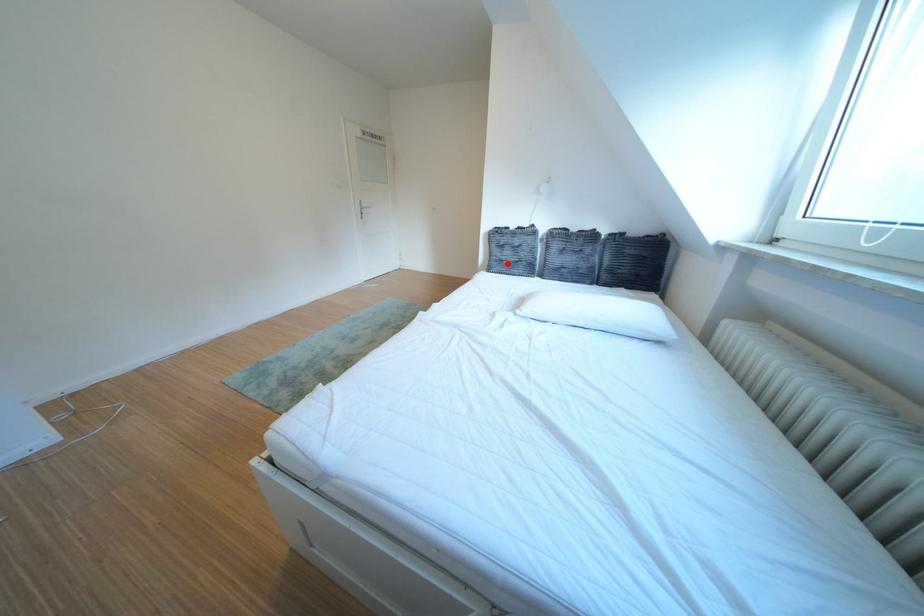
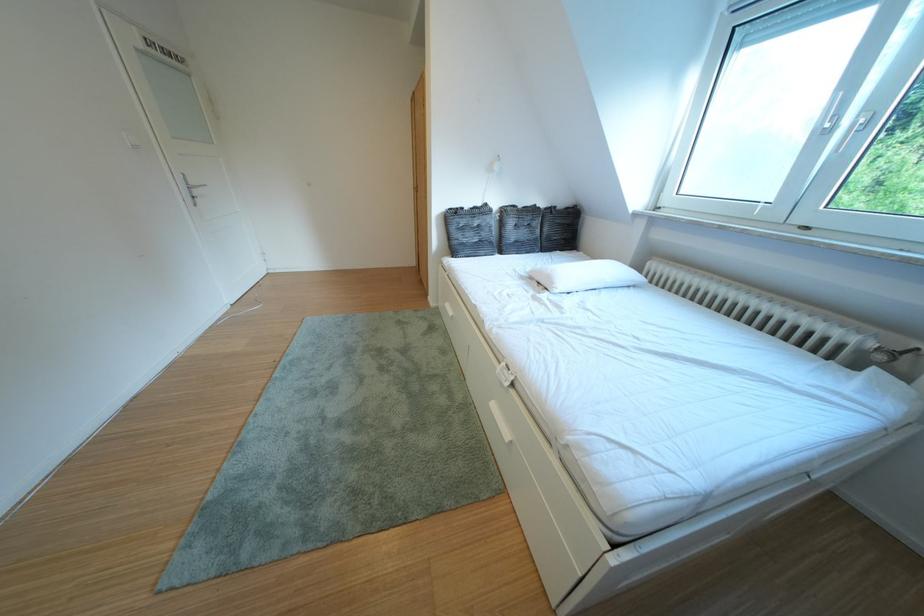
Locate, in the second image, the point that corresponds to the highlighted location in the first image.

(468, 246)